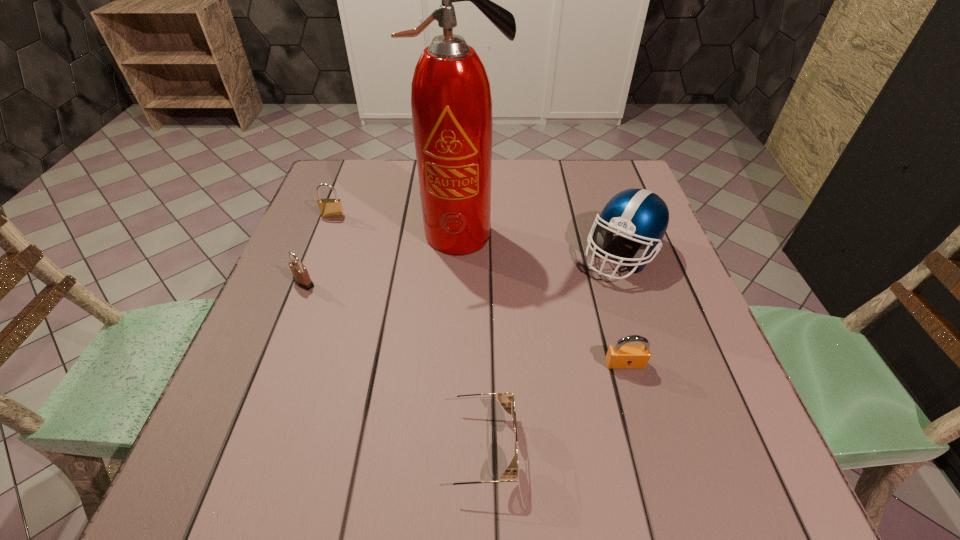
Locate an element on the screen. The image size is (960, 540). free space between the second farthest padlock and the nearest object is located at coordinates (390, 365).

Identify the location of free spot between the football helmet and the tallest object. This screenshot has width=960, height=540. (541, 245).

Find the location of a particular element. The width and height of the screenshot is (960, 540). vacant space that's between the second farthest padlock and the fifth shortest object is located at coordinates (463, 269).

Identify which object is the nearest to the second nearest padlock. Please provide its 2D coordinates. Your answer should be formatted as a tuple, i.e. [(x, y)], where the tuple contains the x and y coordinates of a point satisfying the conditions above.

[(329, 208)]

Point out which object is positioned as the fourth nearest to the farthest padlock. Please provide its 2D coordinates. Your answer should be formatted as a tuple, i.e. [(x, y)], where the tuple contains the x and y coordinates of a point satisfying the conditions above.

[(505, 398)]

Choose which padlock is the third nearest neighbor to the fifth shortest object. Please provide its 2D coordinates. Your answer should be formatted as a tuple, i.e. [(x, y)], where the tuple contains the x and y coordinates of a point satisfying the conditions above.

[(301, 277)]

Select which padlock is the second closest to the fire extinguisher. Please provide its 2D coordinates. Your answer should be formatted as a tuple, i.e. [(x, y)], where the tuple contains the x and y coordinates of a point satisfying the conditions above.

[(301, 277)]

I want to click on vacant position in the image that satisfies the following two spatial constraints: 1. on the front-facing side of the farthest padlock; 2. on the left side of the tallest object, so click(325, 235).

This screenshot has height=540, width=960. In order to click on vacant region that satisfies the following two spatial constraints: 1. on the front-facing side of the tallest object; 2. on the left side of the farthest padlock in this screenshot , I will do `click(325, 235)`.

Locate an element on the screen. The image size is (960, 540). vacant space that satisfies the following two spatial constraints: 1. to unlock the nearest padlock from the front; 2. on the front lenses of the nearest object is located at coordinates (648, 447).